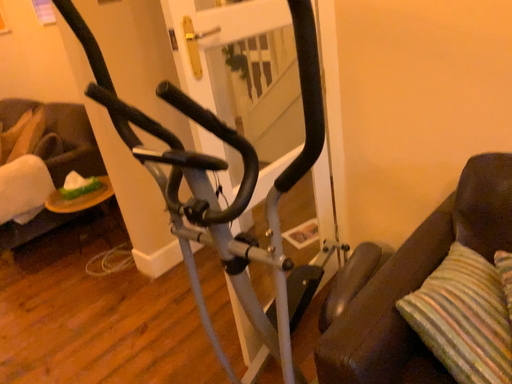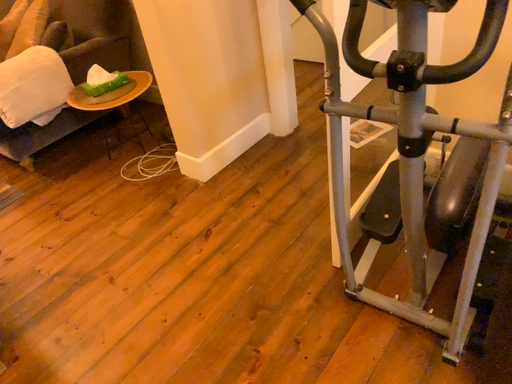
Question: How did the camera likely rotate when shooting the video?

Choices:
 (A) rotated downward
 (B) rotated upward

Answer: (A)